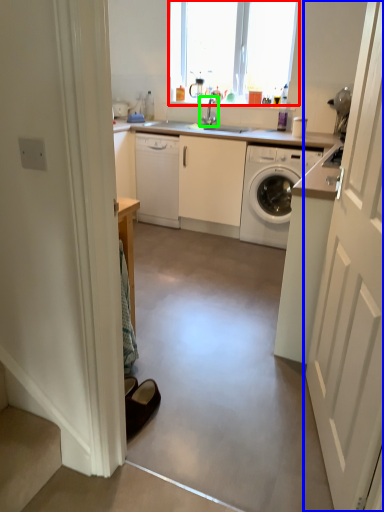
Question: Which object is the farthest from window (highlighted by a red box)? Choose among these: door (highlighted by a blue box) or tap (highlighted by a green box).

Choices:
 (A) door
 (B) tap

Answer: (A)